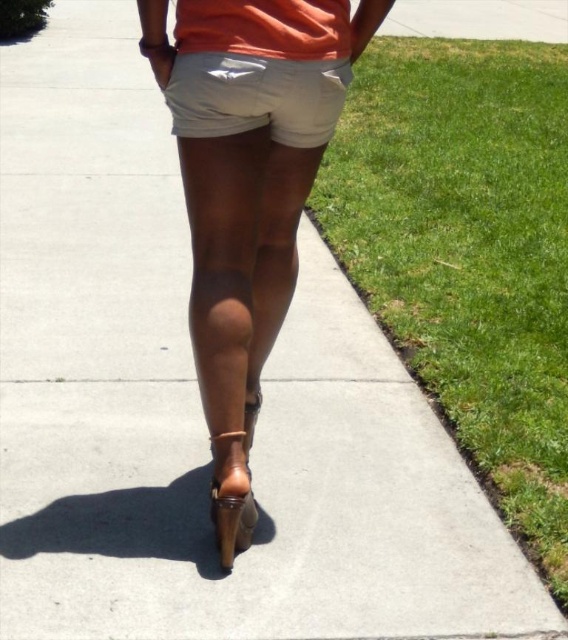
You are a photographer capturing the scene described. You want to place a marker exactly where the tan leather high heels at center are located. According to the coordinates provided, what are the exact coordinates where you should place the marker?

The exact coordinates to place the marker for the tan leather high heels at center are at point (240, 259).